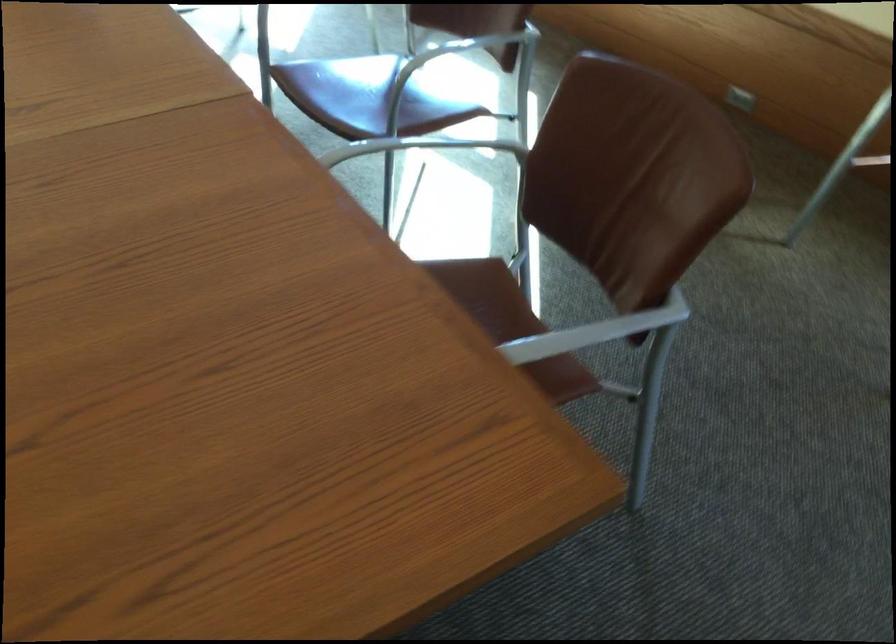
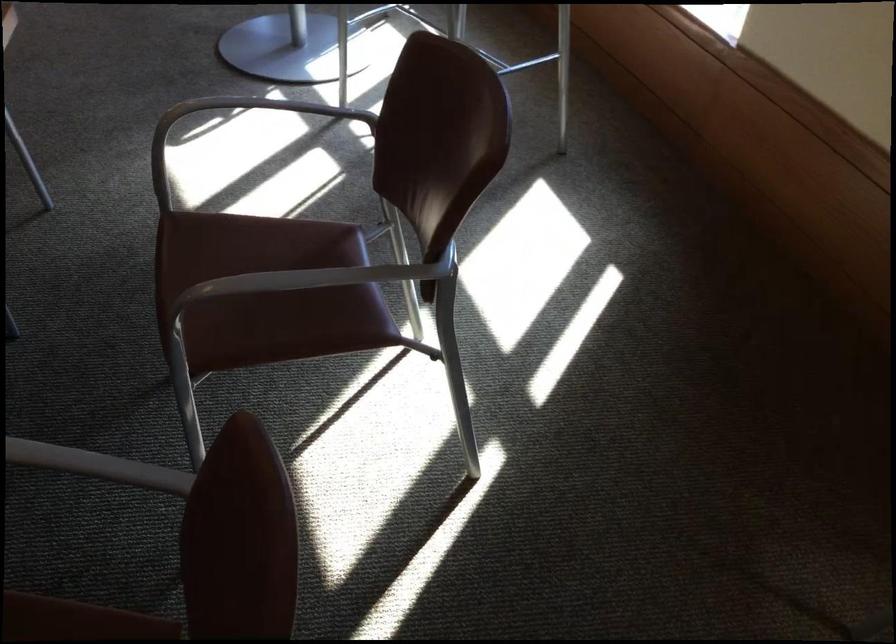
Which direction would the cameraman need to move to produce the second image?

The cameraman moved toward right, forward.